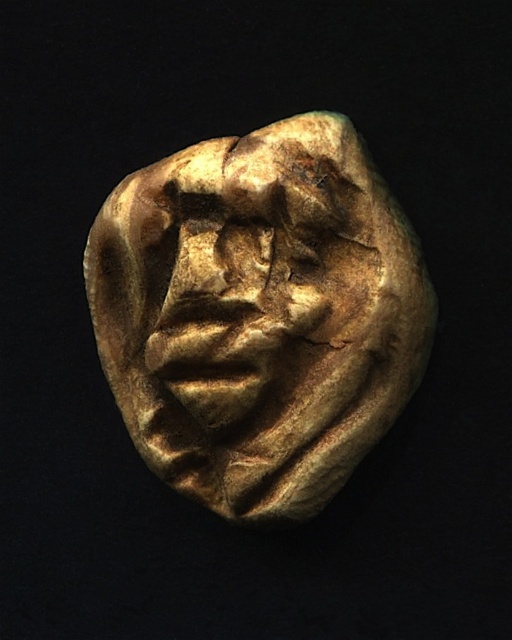
You are an archaeologist examining the carved stone or clay object. You notice two masks on it. The first is labeled as gold textured mask at center, and the second is golden textured mask at center. Which one is wider?

The gold textured mask at center is wider than the golden textured mask at center according to the description.

You are an archaeologist examining two ancient masks displayed side by side in a museum. You notice that both are labeled as gold textured mask at center and golden textured mask at center. Based on the description provided, which mask is taller?

The gold textured mask at center is taller than the golden textured mask at center according to the description.